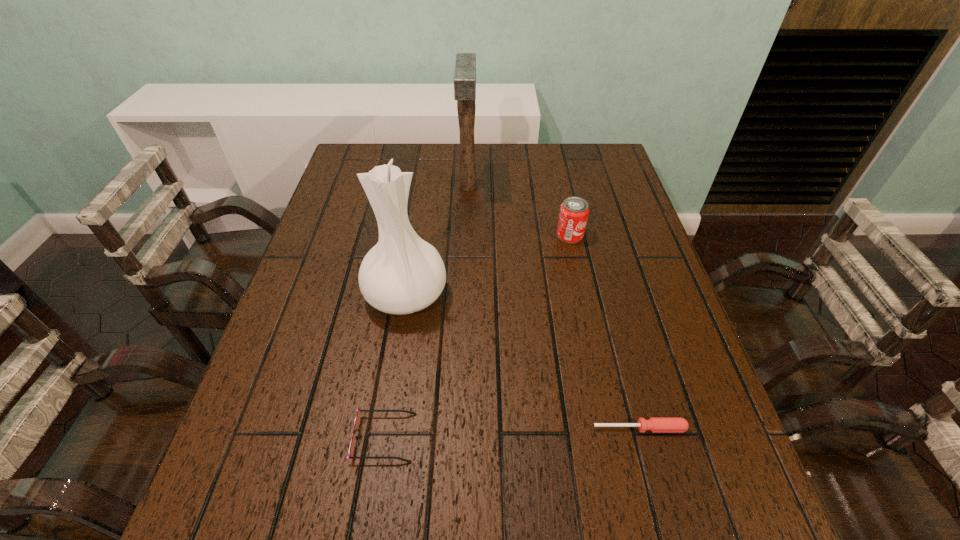
At what (x,y) coordinates should I click in order to perform the action: click on the third object from left to right. Please return your answer as a coordinate pair (x, y). This screenshot has width=960, height=540. Looking at the image, I should click on (465, 66).

Image resolution: width=960 pixels, height=540 pixels. Identify the location of mallet. (465, 66).

At what (x,y) coordinates should I click in order to perform the action: click on vase. Please return your answer as a coordinate pair (x, y). This screenshot has height=540, width=960. Looking at the image, I should click on (402, 274).

At what (x,y) coordinates should I click in order to perform the action: click on the third tallest object. Please return your answer as a coordinate pair (x, y). The image size is (960, 540). Looking at the image, I should click on (574, 211).

At what (x,y) coordinates should I click in order to perform the action: click on can. Please return your answer as a coordinate pair (x, y). Looking at the image, I should click on (574, 211).

The width and height of the screenshot is (960, 540). I want to click on sunglasses, so click(x=357, y=420).

This screenshot has width=960, height=540. What are the coordinates of `screwdriver` in the screenshot? It's located at [655, 424].

I want to click on vacant space located 0.080m on the back of the third object from right to left, so click(469, 158).

I want to click on vacant region located on the left of the third farthest object, so click(x=307, y=295).

The width and height of the screenshot is (960, 540). What are the coordinates of `free space located 0.050m on the left of the can` in the screenshot? It's located at (539, 235).